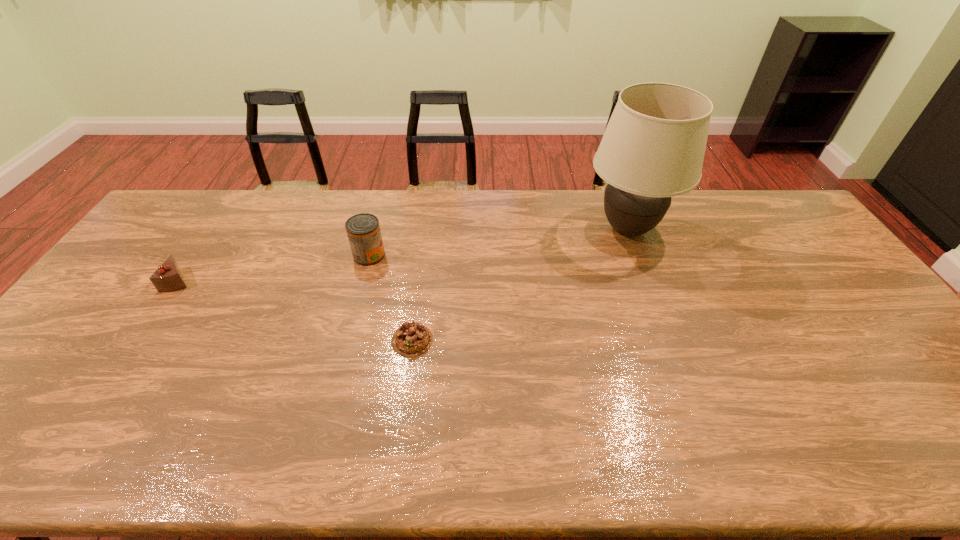
I want to click on free location that satisfies the following two spatial constraints: 1. on the back side of the third tallest object; 2. on the left side of the tallest object, so click(x=213, y=230).